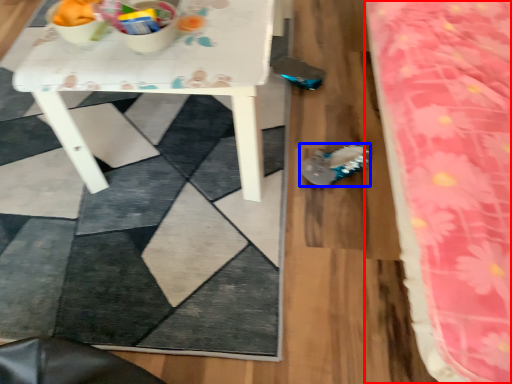
Question: Among these objects, which one is nearest to the camera, bed (highlighted by a red box) or footwear (highlighted by a blue box)?

Choices:
 (A) bed
 (B) footwear

Answer: (A)